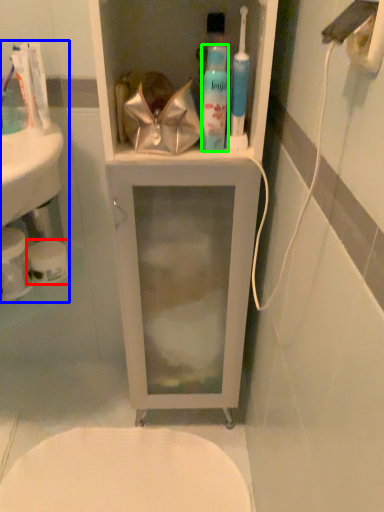
Question: Considering the real-world distances, which object is closest to toilet paper (highlighted by a red box)? sink (highlighted by a blue box) or mouthwash (highlighted by a green box).

Choices:
 (A) sink
 (B) mouthwash

Answer: (A)